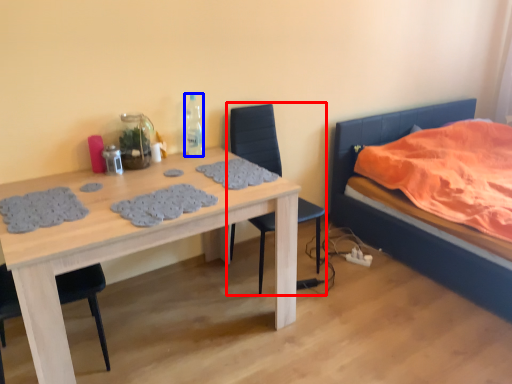
Question: Among these objects, which one is nearest to the camera, chair (highlighted by a red box) or bottle (highlighted by a blue box)?

Choices:
 (A) chair
 (B) bottle

Answer: (A)